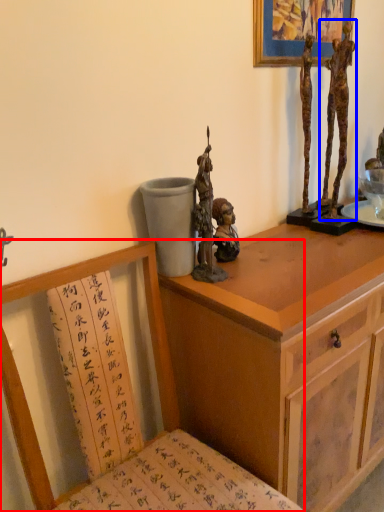
Question: Which object is further to the camera taking this photo, chair (highlighted by a red box) or person (highlighted by a blue box)?

Choices:
 (A) chair
 (B) person

Answer: (B)